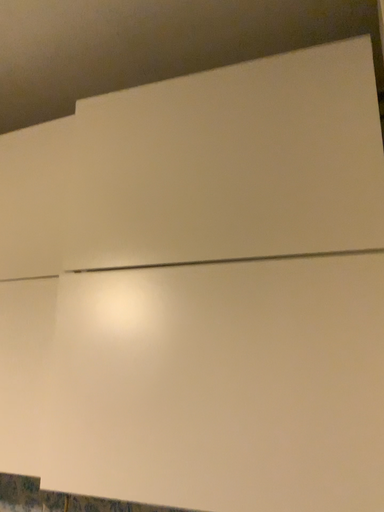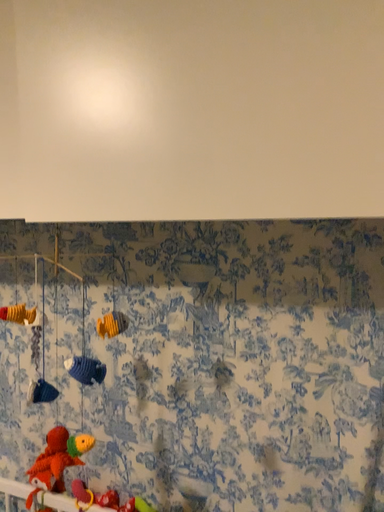
Question: How did the camera likely rotate when shooting the video?

Choices:
 (A) rotated upward
 (B) rotated downward

Answer: (B)